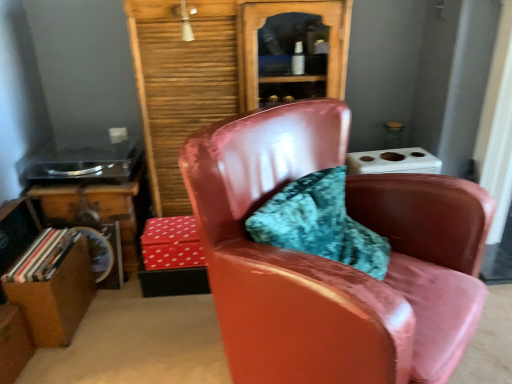
Question: From a real-world perspective, does wooden bookcase at center sit lower than glossy leather chair at center?

Choices:
 (A) no
 (B) yes

Answer: (A)

Question: Is wooden bookcase at center looking in the opposite direction of glossy leather chair at center?

Choices:
 (A) yes
 (B) no

Answer: (B)

Question: Can you confirm if wooden bookcase at center is positioned to the right of glossy leather chair at center?

Choices:
 (A) yes
 (B) no

Answer: (B)

Question: Is wooden bookcase at center beside glossy leather chair at center?

Choices:
 (A) no
 (B) yes

Answer: (A)

Question: From the image's perspective, is wooden bookcase at center beneath glossy leather chair at center?

Choices:
 (A) no
 (B) yes

Answer: (A)

Question: Is wooden bookcase at center not within glossy leather chair at center?

Choices:
 (A) no
 (B) yes

Answer: (B)

Question: Considering the relative sizes of glossy leather chair at center and wooden bookcase at center in the image provided, is glossy leather chair at center shorter than wooden bookcase at center?

Choices:
 (A) yes
 (B) no

Answer: (A)

Question: Is glossy leather chair at center in contact with wooden bookcase at center?

Choices:
 (A) yes
 (B) no

Answer: (B)

Question: From the image's perspective, is glossy leather chair at center over wooden bookcase at center?

Choices:
 (A) no
 (B) yes

Answer: (A)

Question: Is the position of glossy leather chair at center more distant than that of wooden bookcase at center?

Choices:
 (A) no
 (B) yes

Answer: (A)

Question: Considering the relative sizes of glossy leather chair at center and wooden bookcase at center in the image provided, is glossy leather chair at center smaller than wooden bookcase at center?

Choices:
 (A) no
 (B) yes

Answer: (A)

Question: From a real-world perspective, is glossy leather chair at center on top of wooden bookcase at center?

Choices:
 (A) no
 (B) yes

Answer: (A)

Question: Is wooden table at lower left far from glossy leather chair at center?

Choices:
 (A) no
 (B) yes

Answer: (B)